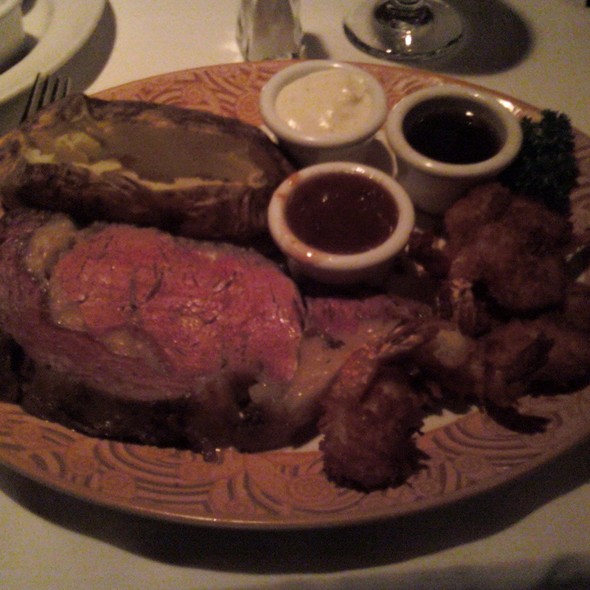
At what (x,y) coordinates should I click in order to perform the action: click on plate. Please return your answer as a coordinate pair (x, y). Looking at the image, I should click on (222, 503), (59, 34).